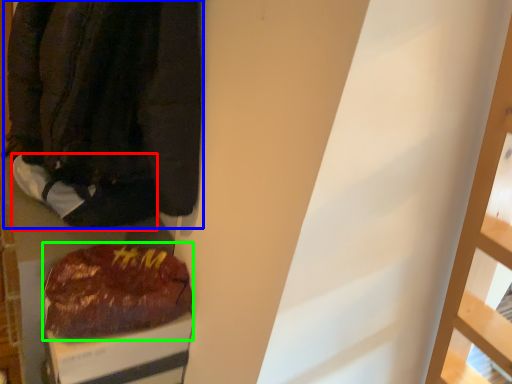
Question: Considering the real-world distances, which object is closest to footwear (highlighted by a red box)? jacket (highlighted by a blue box) or food (highlighted by a green box).

Choices:
 (A) jacket
 (B) food

Answer: (A)